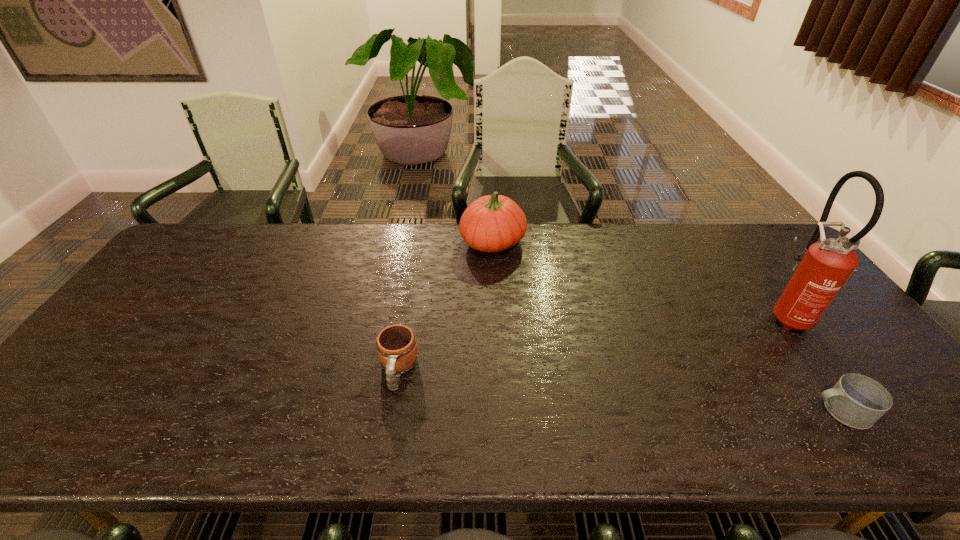
The width and height of the screenshot is (960, 540). I want to click on free point between the fire extinguisher and the third object from right to left, so click(x=641, y=279).

Where is `free space between the second tallest object and the taller mug`? The width and height of the screenshot is (960, 540). free space between the second tallest object and the taller mug is located at coordinates (445, 306).

Image resolution: width=960 pixels, height=540 pixels. Find the location of `vacant area that lies between the left mug and the tallest object`. vacant area that lies between the left mug and the tallest object is located at coordinates (593, 343).

The height and width of the screenshot is (540, 960). Identify the location of free space between the farthest object and the taller mug. (445, 306).

Where is `free space that is in between the left mug and the second object from left to right`? The width and height of the screenshot is (960, 540). free space that is in between the left mug and the second object from left to right is located at coordinates (445, 306).

The height and width of the screenshot is (540, 960). Identify the location of object that is the closest to the pumpkin. (396, 345).

Identify which object is the closest to the second shortest object. Please provide its 2D coordinates. Your answer should be formatted as a tuple, i.e. [(x, y)], where the tuple contains the x and y coordinates of a point satisfying the conditions above.

[(493, 223)]

Locate an element on the screen. free location that satisfies the following two spatial constraints: 1. at the nozzle of the second farthest object; 2. on the side of the leftmost object with the handle is located at coordinates (828, 370).

This screenshot has width=960, height=540. Find the location of `vacant space that satisfies the following two spatial constraints: 1. at the nozzle of the tallest object; 2. on the side of the leftmost object with the handle`. vacant space that satisfies the following two spatial constraints: 1. at the nozzle of the tallest object; 2. on the side of the leftmost object with the handle is located at coordinates (828, 370).